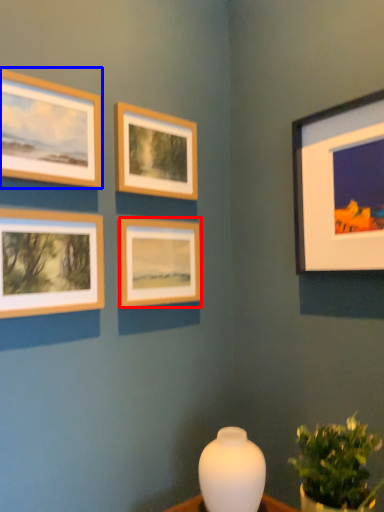
Question: Which object is closer to the camera taking this photo, picture frame (highlighted by a red box) or picture frame (highlighted by a blue box)?

Choices:
 (A) picture frame
 (B) picture frame

Answer: (B)